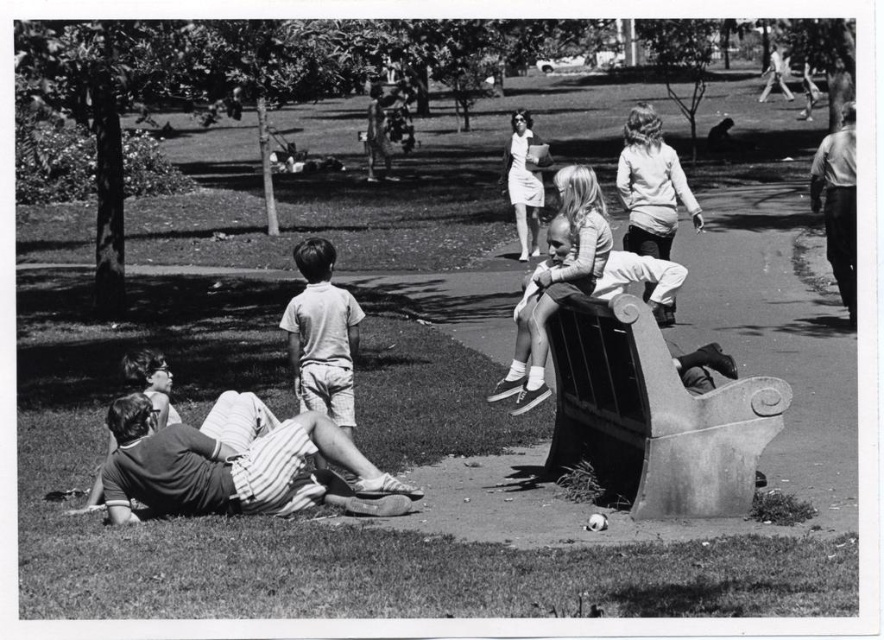
Can you confirm if smooth stone bench at center right is positioned to the right of striped cotton shorts at lower left?

Yes, smooth stone bench at center right is to the right of striped cotton shorts at lower left.

Does point (728, 472) lie in front of point (280, 488)?

Yes, point (728, 472) is closer to viewer.

In order to click on smooth stone bench at center right in this screenshot , I will do [x=653, y=416].

Who is higher up, smooth stone bench at center right or light gray cotton shorts at center?

light gray cotton shorts at center is higher up.

Between smooth stone bench at center right and light gray cotton shorts at center, which one appears on the left side from the viewer's perspective?

light gray cotton shorts at center

Who is more forward, (597,312) or (303,266)?

Point (597,312) is more forward.

Find the location of a particular element. smooth stone bench at center right is located at coordinates (653, 416).

Who is lower down, striped cotton shorts at lower left or light gray cotton shorts at center?

striped cotton shorts at lower left is lower down.

This screenshot has width=884, height=640. What do you see at coordinates (237, 468) in the screenshot?
I see `striped cotton shorts at lower left` at bounding box center [237, 468].

This screenshot has width=884, height=640. In order to click on striped cotton shorts at lower left in this screenshot , I will do `click(237, 468)`.